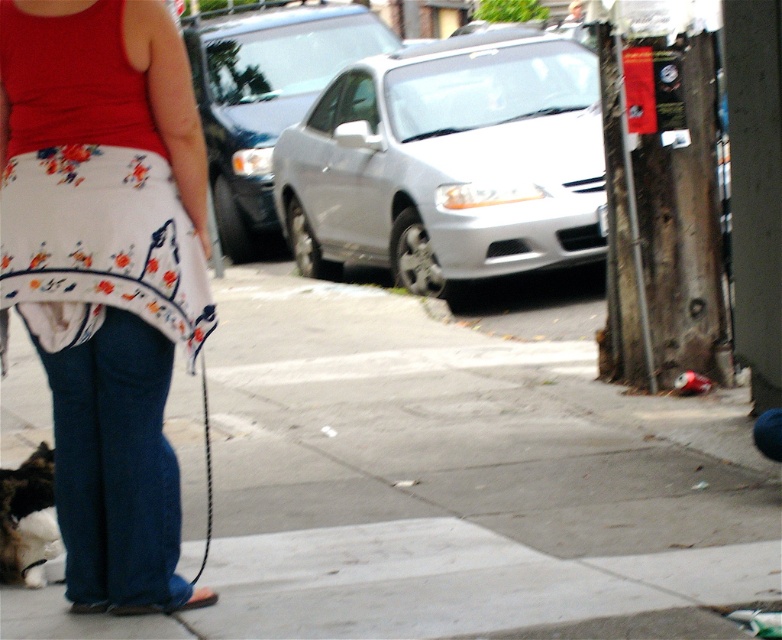
You are a delivery robot navigating through the street scene. You need to move from the gray concrete sidewalk at center to the fluffy fur cat at lower left. Which path should you take to avoid obstacles?

The gray concrete sidewalk at center has a smaller size compared to the fluffy fur cat at lower left, so you should navigate around the larger fluffy fur cat at lower left to avoid collision.